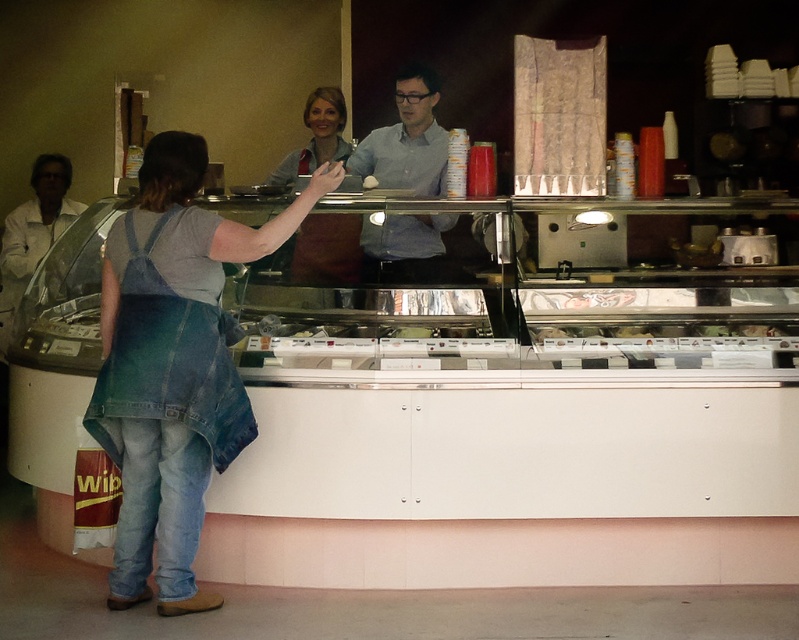
Question: Is matte blue apron at center bigger than white matte jacket at left?

Choices:
 (A) yes
 (B) no

Answer: (B)

Question: Which of the following is the farthest from the observer?

Choices:
 (A) (148, 193)
 (B) (297, 276)

Answer: (B)

Question: Among these points, which one is farthest from the camera?

Choices:
 (A) (137, 212)
 (B) (378, 166)
 (C) (34, 248)

Answer: (C)

Question: Estimate the real-world distances between objects in this image. Which object is closer to the matte blue apron at center?

Choices:
 (A) denim overalls at left
 (B) blue shirt at center

Answer: (B)

Question: Is matte blue apron at center to the left of white matte jacket at left from the viewer's perspective?

Choices:
 (A) yes
 (B) no

Answer: (B)

Question: Can you confirm if denim overalls at left is wider than white matte jacket at left?

Choices:
 (A) no
 (B) yes

Answer: (B)